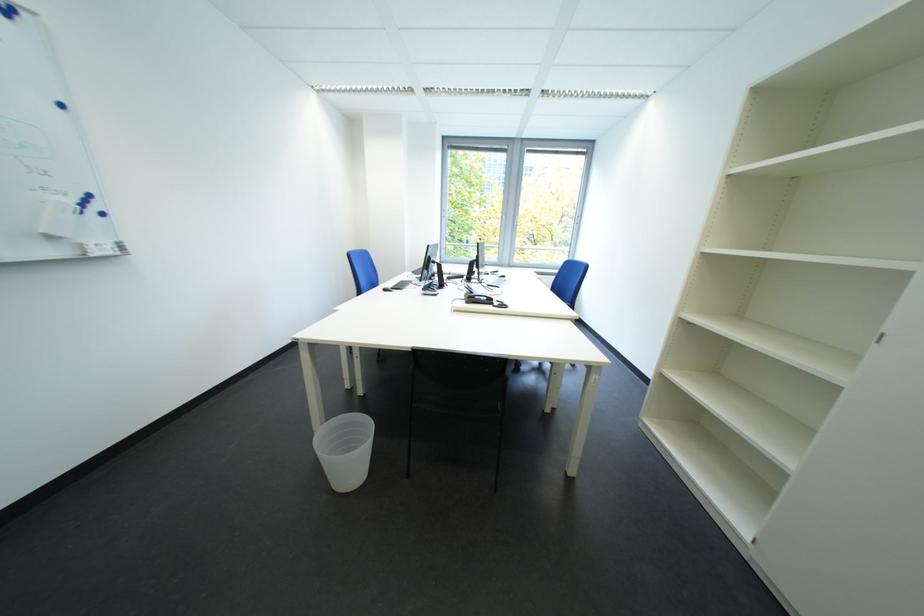
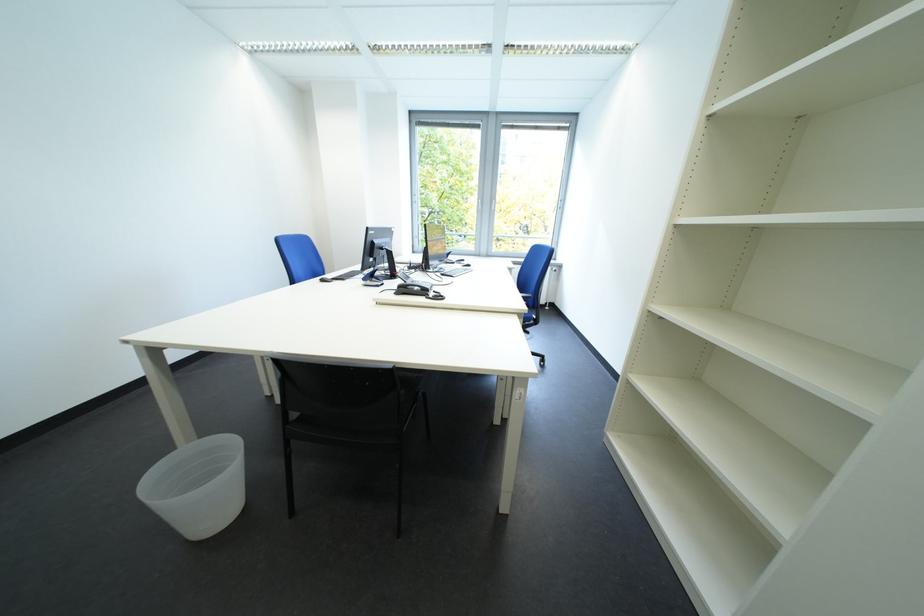
The images are taken continuously from a first-person perspective. In which direction are you moving?

The cameraman moved toward right, forward.